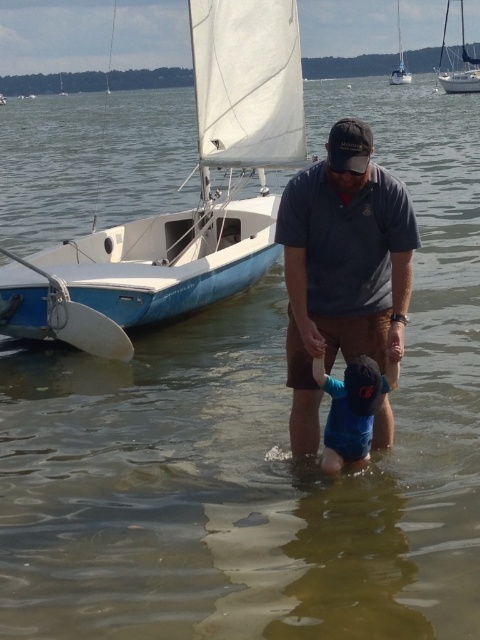
You are standing at the point with coordinates point (0, 100) and want to see the point with coordinates point (369, 426). Can you see it without moving your position?

Point (369, 426) is in front of point (0, 100), so yes, you can see it from your current position without moving.

You are a photographer trying to capture the man and child in the waterfront scene. You notice a point at coordinates (x=352, y=406). What object is located at this point?

The point at coordinates (x=352, y=406) corresponds to the blue cotton shirt at lower center.

You are a photographer trying to capture a photo of the dark gray cotton shirt at center and the white sailboat at upper right. Which object should you focus on first if you want to ensure both are in sharp focus, considering their sizes?

The dark gray cotton shirt at center has a smaller size compared to the white sailboat at upper right, so you should focus on the smaller object first to ensure both are in sharp focus.